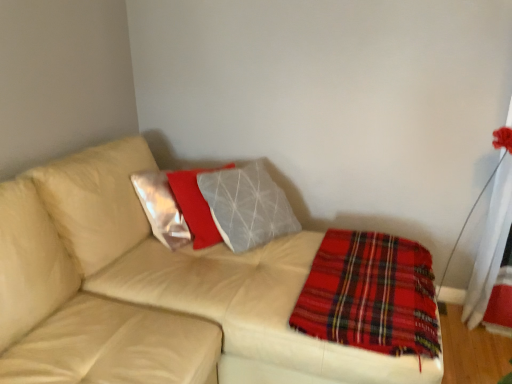
You are a GUI agent. You are given a task and a screenshot of the screen. Output one action in this format:
    pyautogui.click(x=<x>, y=<y>)
    Task: Click on the leather couch at center
    
    Given the screenshot: What is the action you would take?
    click(x=150, y=283)

What do you see at coordinates (150, 283) in the screenshot? The width and height of the screenshot is (512, 384). I see `leather couch at center` at bounding box center [150, 283].

What is the approximate width of leather couch at center?

leather couch at center is 5.51 feet wide.

Find the location of a particular element. red plaid blanket at lower right is located at coordinates click(x=370, y=295).

Describe the element at coordinates (370, 295) in the screenshot. This screenshot has height=384, width=512. I see `red plaid blanket at lower right` at that location.

Identify the location of leather couch at center. (150, 283).

Is red plaid blanket at lower right to the left of leather couch at center from the viewer's perspective?

Incorrect, red plaid blanket at lower right is not on the left side of leather couch at center.

In the image, is red plaid blanket at lower right positioned in front of or behind leather couch at center?

Clearly, red plaid blanket at lower right is behind leather couch at center.

Is point (318, 335) closer or farther from the camera than point (6, 239)?

Point (318, 335) is positioned farther from the camera compared to point (6, 239).

From the image's perspective, is red plaid blanket at lower right located beneath leather couch at center?

Indeed, from the image's perspective, red plaid blanket at lower right is shown beneath leather couch at center.

From a real-world perspective, who is located lower, red plaid blanket at lower right or leather couch at center?

From a 3D spatial view, leather couch at center is below.

Does red plaid blanket at lower right have a lesser width compared to leather couch at center?

Correct, the width of red plaid blanket at lower right is less than that of leather couch at center.

Can you confirm if red plaid blanket at lower right is taller than leather couch at center?

In fact, red plaid blanket at lower right may be shorter than leather couch at center.

Based on the photo, between red plaid blanket at lower right and leather couch at center, which one has smaller size?

With smaller size is red plaid blanket at lower right.

Do you think red plaid blanket at lower right is within leather couch at center, or outside of it?

red plaid blanket at lower right exists entirely within leather couch at center.

Is red plaid blanket at lower right in contact with leather couch at center?

No, red plaid blanket at lower right is not next to leather couch at center.

Is leather couch at center at the back of red plaid blanket at lower right?

Absolutely, red plaid blanket at lower right is directed away from leather couch at center.

What's the angular difference between red plaid blanket at lower right and leather couch at center's facing directions?

red plaid blanket at lower right and leather couch at center are facing 0.000135 degrees away from each other.

Measure the distance from red plaid blanket at lower right to leather couch at center.

They are 16.03 inches apart.

Locate an element on the screen. blanket on the right of leather couch at center is located at coordinates (370, 295).

Consider the image. Does leather couch at center appear on the right side of red plaid blanket at lower right?

No, leather couch at center is not to the right of red plaid blanket at lower right.

Considering the positions of objects leather couch at center and red plaid blanket at lower right in the image provided, who is in front, leather couch at center or red plaid blanket at lower right?

leather couch at center is closer to the camera.

Is point (38, 351) positioned after point (370, 255)?

No, it is not.

From the image's perspective, between leather couch at center and red plaid blanket at lower right, which one is located above?

leather couch at center appears higher in the image.

From a real-world perspective, relative to red plaid blanket at lower right, is leather couch at center vertically above or below?

Clearly, from a real-world perspective, leather couch at center is below red plaid blanket at lower right.

Considering the sizes of leather couch at center and red plaid blanket at lower right in the image, is leather couch at center wider or thinner than red plaid blanket at lower right?

Considering their sizes, leather couch at center looks broader than red plaid blanket at lower right.

Is leather couch at center taller or shorter than red plaid blanket at lower right?

Considering their sizes, leather couch at center has more height than red plaid blanket at lower right.

Can you confirm if leather couch at center is smaller than red plaid blanket at lower right?

Incorrect, leather couch at center is not smaller in size than red plaid blanket at lower right.

Would you say red plaid blanket at lower right is part of leather couch at center's contents?

That's correct, red plaid blanket at lower right is inside leather couch at center.

Are leather couch at center and red plaid blanket at lower right far apart?

leather couch at center is actually quite close to red plaid blanket at lower right.

Is leather couch at center facing towards red plaid blanket at lower right?

Yes, leather couch at center is facing red plaid blanket at lower right.

Find the location of a particular element. The width and height of the screenshot is (512, 384). studio couch that appears above the red plaid blanket at lower right (from the image's perspective) is located at coordinates (150, 283).

Find the location of a particular element. This screenshot has height=384, width=512. studio couch that appears above the red plaid blanket at lower right (from the image's perspective) is located at coordinates (150, 283).

At what (x,y) coordinates should I click in order to perform the action: click on blanket below the leather couch at center (from the image's perspective). Please return your answer as a coordinate pair (x, y). This screenshot has width=512, height=384. Looking at the image, I should click on point(370,295).